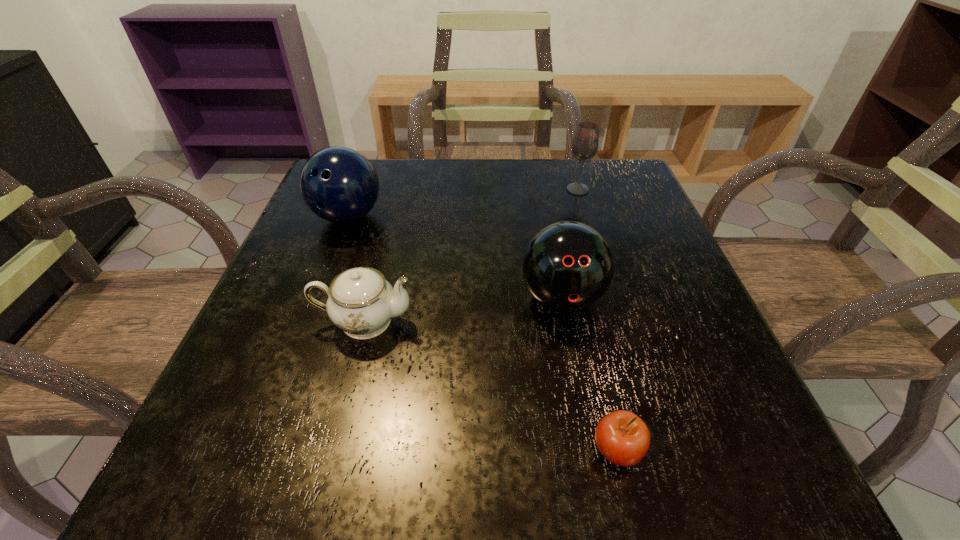
The height and width of the screenshot is (540, 960). Identify the location of vacant space that satisfies the following two spatial constraints: 1. at the spout of the chinaware; 2. on the back side of the shortest object. (331, 450).

Find the location of a particular element. vacant region that satisfies the following two spatial constraints: 1. on the surface of the apple near the finger holes; 2. on the right side of the left bowling ball is located at coordinates (260, 450).

Identify the location of free location that satisfies the following two spatial constraints: 1. at the spout of the chinaware; 2. on the right side of the apple. Image resolution: width=960 pixels, height=540 pixels. (331, 450).

Where is `blank area in the image that satisfies the following two spatial constraints: 1. on the surface of the nearest object near the finger holes; 2. on the left side of the nearer bowling ball`? Image resolution: width=960 pixels, height=540 pixels. blank area in the image that satisfies the following two spatial constraints: 1. on the surface of the nearest object near the finger holes; 2. on the left side of the nearer bowling ball is located at coordinates (590, 450).

The image size is (960, 540). I want to click on vacant space that satisfies the following two spatial constraints: 1. on the surface of the left bowling ball near the finger holes; 2. on the left side of the nearest object, so click(260, 450).